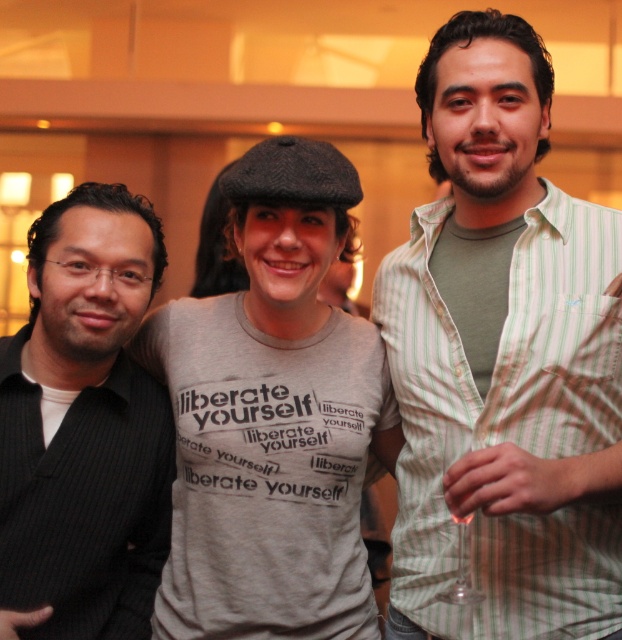
Can you confirm if green striped shirt at center is shorter than gray cotton t-shirt at center?

No.

Is green striped shirt at center taller than gray cotton t-shirt at center?

Indeed, green striped shirt at center has a greater height compared to gray cotton t-shirt at center.

Is point (508, 438) positioned behind point (341, 323)?

No, it is in front of (341, 323).

Identify the location of green striped shirt at center. This screenshot has width=622, height=640. (503, 358).

Who is shorter, green striped shirt at center or black pinstripe suit at left?

With less height is black pinstripe suit at left.

Is green striped shirt at center bigger than black pinstripe suit at left?

Correct, green striped shirt at center is larger in size than black pinstripe suit at left.

You are a GUI agent. You are given a task and a screenshot of the screen. Output one action in this format:
    pyautogui.click(x=<x>, y=<y>)
    Task: Click on the green striped shirt at center
    This screenshot has width=622, height=640.
    Given the screenshot: What is the action you would take?
    pyautogui.click(x=503, y=358)

Where is `green striped shirt at center`? Image resolution: width=622 pixels, height=640 pixels. green striped shirt at center is located at coordinates (503, 358).

Is gray cotton t-shirt at center in front of black pinstripe suit at left?

No.

Does gray cotton t-shirt at center have a larger size compared to black pinstripe suit at left?

Yes, gray cotton t-shirt at center is bigger than black pinstripe suit at left.

This screenshot has width=622, height=640. What do you see at coordinates (272, 417) in the screenshot?
I see `gray cotton t-shirt at center` at bounding box center [272, 417].

Locate an element on the screen. This screenshot has width=622, height=640. gray cotton t-shirt at center is located at coordinates (272, 417).